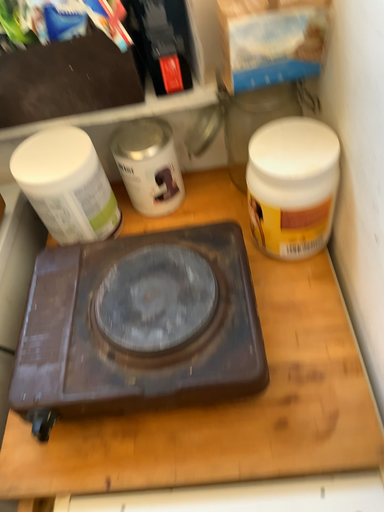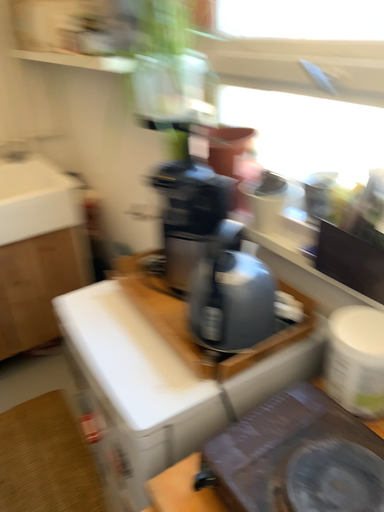
Question: Which way did the camera rotate in the video?

Choices:
 (A) rotated downward
 (B) rotated upward

Answer: (B)